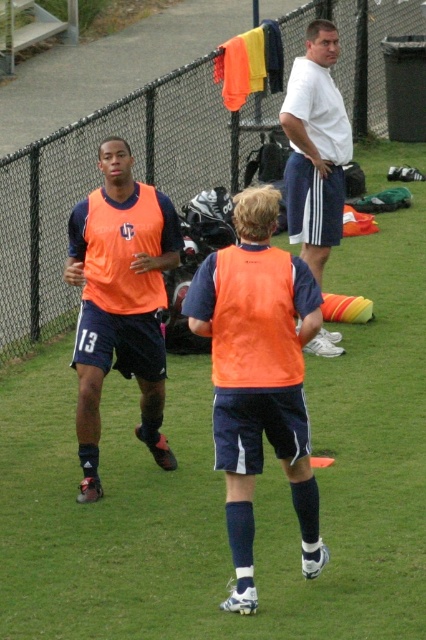
Is metallic chain-link fence at upper center behind matte orange vest at center?

Yes.

This screenshot has height=640, width=426. Identify the location of metallic chain-link fence at upper center. (97, 182).

Between point (377, 131) and point (72, 228), which one is positioned in front?

Positioned in front is point (72, 228).

The image size is (426, 640). Identify the location of metallic chain-link fence at upper center. (97, 182).

Can you confirm if matte orange vest at center is shorter than white cotton shirt at upper center?

Incorrect, matte orange vest at center's height does not fall short of white cotton shirt at upper center's.

Is matte orange vest at center positioned at the back of white cotton shirt at upper center?

No, it is not.

Is point (92, 428) farther from viewer compared to point (331, 177)?

No.

Identify the location of matte orange vest at center. The height and width of the screenshot is (640, 426). (120, 301).

Between point (307, 464) and point (83, 262), which one is positioned behind?

Positioned behind is point (83, 262).

Does orange matte vest at center appear on the left side of matte orange vest at center?

No, orange matte vest at center is not to the left of matte orange vest at center.

Who is more forward, (x=215, y=442) or (x=152, y=205)?

Point (x=215, y=442)

Locate an element on the screen. This screenshot has height=640, width=426. orange matte vest at center is located at coordinates (259, 376).